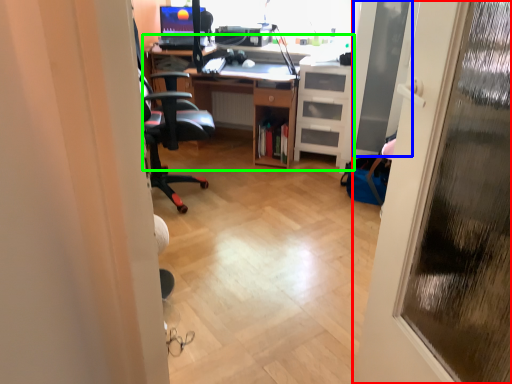
Question: Considering the real-world distances, which object is farthest from door (highlighted by a red box)? screen door (highlighted by a blue box) or computer desk (highlighted by a green box)?

Choices:
 (A) screen door
 (B) computer desk

Answer: (B)